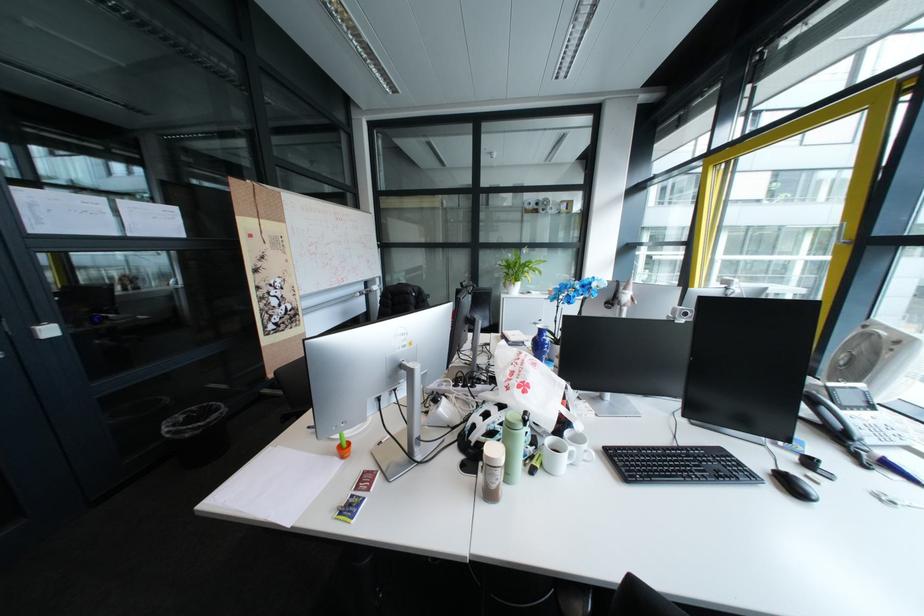
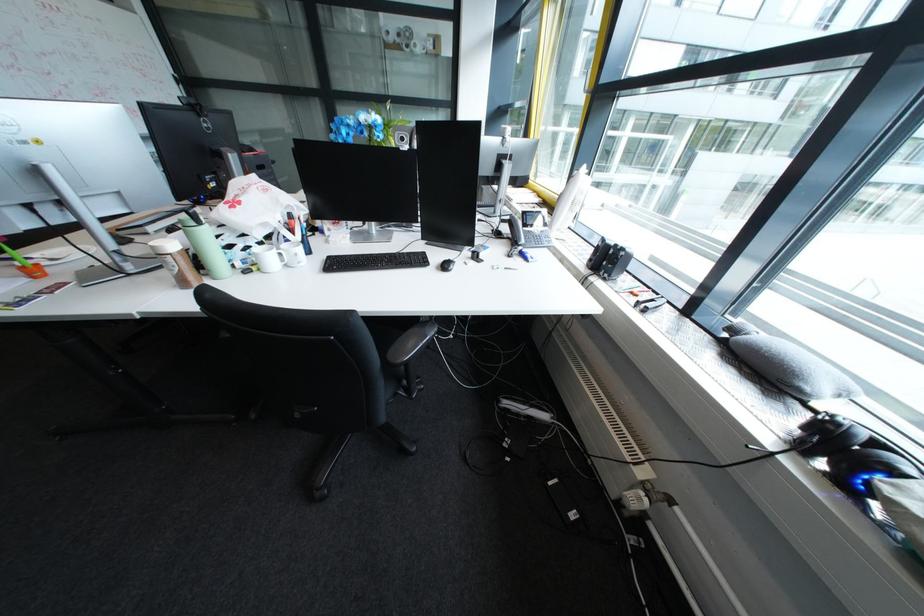
Question: I am providing you with two images of the same scene from different viewpoints. After the viewpoint changes to image2, which objects are now occluded?

Choices:
 (A) gray laptop sleeve
 (B) white bicycle helmet
 (C) light green bottle
 (D) white mug

Answer: (B)